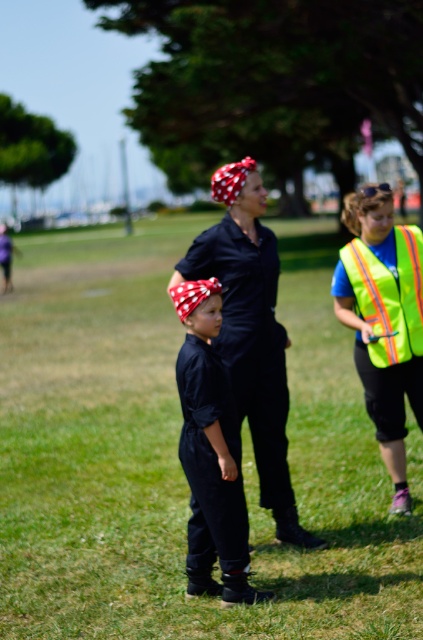
Who is shorter, matte black jumpsuit at center or neon yellow reflective safety vest at right?

With less height is neon yellow reflective safety vest at right.

Locate an element on the screen. matte black jumpsuit at center is located at coordinates (211, 451).

Locate an element on the screen. This screenshot has height=640, width=423. matte black jumpsuit at center is located at coordinates (211, 451).

Is point (282, 435) behind point (398, 280)?

No, (282, 435) is closer to viewer.

This screenshot has height=640, width=423. Find the location of `matte black shirt at center`. matte black shirt at center is located at coordinates (250, 330).

This screenshot has height=640, width=423. What are the coordinates of `matte black shirt at center` in the screenshot? It's located at (250, 330).

Is green grass at center bigger than matte black jumpsuit at center?

Yes.

Is point (378, 449) in front of point (206, 429)?

No, (378, 449) is further to viewer.

Locate an element on the screen. This screenshot has height=640, width=423. green grass at center is located at coordinates (176, 458).